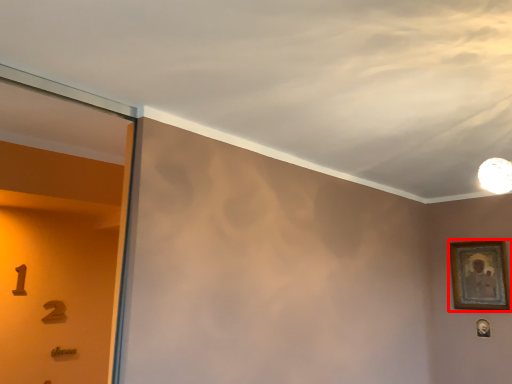
Question: Observing the image, what is the correct spatial positioning of picture frame (annotated by the red box) in reference to picture frame?

Choices:
 (A) right
 (B) left

Answer: (B)